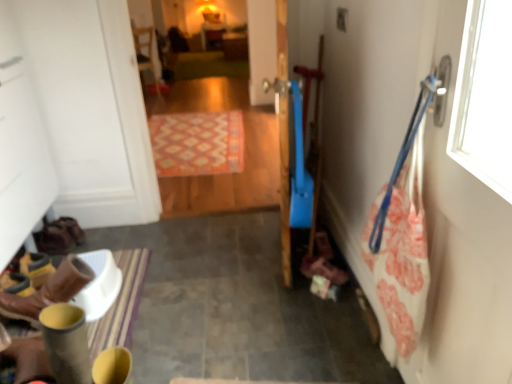
In order to face patterned carpet at center, should I rotate leftwards or rightwards?

A 5.866 degree turn to the left will do.

Where is `patterned carpet at center`? This screenshot has height=384, width=512. patterned carpet at center is located at coordinates (197, 143).

Which is less distant, (274,203) or (32,309)?

Positioned in front is point (32,309).

From the picture: Does patterned carpet at center have a larger size compared to brown leather boots at lower left?

Yes, patterned carpet at center is bigger than brown leather boots at lower left.

Considering the sizes of objects patterned carpet at center and brown leather boots at lower left in the image provided, who is wider, patterned carpet at center or brown leather boots at lower left?

brown leather boots at lower left is wider.

What's the angular difference between patterned carpet at center and brown leather boots at lower left's facing directions?

The angular difference between patterned carpet at center and brown leather boots at lower left is 95.7 degrees.

How different are the orientations of wooden chair at upper center and patterned carpet at center in degrees?

148 degrees separate the facing orientations of wooden chair at upper center and patterned carpet at center.

Can you confirm if wooden chair at upper center is positioned to the right of patterned carpet at center?

No.

Is wooden chair at upper center aimed at patterned carpet at center?

No, wooden chair at upper center is not facing towards patterned carpet at center.

Considering the relative sizes of wooden chair at upper center and patterned carpet at center in the image provided, is wooden chair at upper center taller than patterned carpet at center?

Indeed, wooden chair at upper center has a greater height compared to patterned carpet at center.

In terms of size, does patterned carpet at center appear bigger or smaller than brown leather boots at lower left?

Clearly, patterned carpet at center is larger in size than brown leather boots at lower left.

Is brown leather boots at lower left located within patterned carpet at center?

No, brown leather boots at lower left is located outside of patterned carpet at center.

Can you tell me how much patterned carpet at center and brown leather boots at lower left differ in facing direction?

They differ by 94.4 degrees in their facing directions.

Considering the sizes of objects patterned carpet at center and brown leather boots at lower left in the image provided, who is taller, patterned carpet at center or brown leather boots at lower left?

brown leather boots at lower left is taller.

Consider the image. Is wooden chair at upper center located outside patterned carpet at center?

Absolutely, wooden chair at upper center is external to patterned carpet at center.

Considering the relative sizes of wooden chair at upper center and patterned carpet at center in the image provided, is wooden chair at upper center wider than patterned carpet at center?

Correct, the width of wooden chair at upper center exceeds that of patterned carpet at center.

Is wooden chair at upper center looking in the opposite direction of patterned carpet at center?

Yes, wooden chair at upper center is positioned with its back facing patterned carpet at center.

This screenshot has height=384, width=512. In order to click on chair that appears below the patterned carpet at center (from a real-world perspective) in this screenshot , I will do `click(146, 53)`.

Between wooden chair at upper center and brown leather boots at lower left, which one appears on the right side from the viewer's perspective?

brown leather boots at lower left.

The image size is (512, 384). I want to click on footwear in front of the wooden chair at upper center, so click(49, 291).

Is wooden chair at upper center aimed at brown leather boots at lower left?

No, wooden chair at upper center does not turn towards brown leather boots at lower left.

In the scene shown: Is wooden chair at upper center outside of brown leather boots at lower left?

Yes, wooden chair at upper center is outside of brown leather boots at lower left.

Is patterned carpet at center facing away from patterned carpet at center?

That's right, patterned carpet at center is facing away from patterned carpet at center.

Is patterned carpet at center not close to patterned carpet at center?

Actually, patterned carpet at center and patterned carpet at center are a little close together.

Considering the relative positions of patterned carpet at center and patterned carpet at center in the image provided, is patterned carpet at center to the left of patterned carpet at center from the viewer's perspective?

Incorrect, patterned carpet at center is not on the left side of patterned carpet at center.

From a real-world perspective, relative to patterned carpet at center, is patterned carpet at center vertically above or below?

Clearly, from a real-world perspective, patterned carpet at center is above patterned carpet at center.

Choose the correct answer: Is patterned carpet at center inside wooden chair at upper center or outside it?

The correct answer is: outside.

Can you confirm if patterned carpet at center is positioned to the left of wooden chair at upper center?

No.

Considering the points (253, 136) and (148, 67), which point is in front, point (253, 136) or point (148, 67)?

The point (253, 136) is closer to the camera.

Considering the sizes of objects patterned carpet at center and wooden chair at upper center in the image provided, who is shorter, patterned carpet at center or wooden chair at upper center?

wooden chair at upper center is shorter.

Find the location of a particular element. The width and height of the screenshot is (512, 384). corridor positioned vertically above the brown leather boots at lower left (from a real-world perspective) is located at coordinates (244, 126).

The width and height of the screenshot is (512, 384). Identify the location of mat in front of the wooden chair at upper center. (197, 143).

Based on the photo, looking at the image, which one is located further to patterned carpet at center, patterned carpet at center or wooden chair at upper center?

Among the two, wooden chair at upper center is located further to patterned carpet at center.

Looking at the image, which one is located closer to patterned carpet at center, wooden chair at upper center or brown leather boots at lower left?

wooden chair at upper center.

From the image, which object appears to be farther from patterned carpet at center, patterned carpet at center or brown leather boots at lower left?

brown leather boots at lower left is further to patterned carpet at center.

When comparing their distances from brown leather boots at lower left, does patterned carpet at center or wooden chair at upper center seem further?

wooden chair at upper center.

Based on their spatial positions, is brown leather boots at lower left or wooden chair at upper center closer to patterned carpet at center?

Among the two, wooden chair at upper center is located nearer to patterned carpet at center.

Based on their spatial positions, is brown leather boots at lower left or patterned carpet at center further from wooden chair at upper center?

Among the two, brown leather boots at lower left is located further to wooden chair at upper center.

Based on their spatial positions, is patterned carpet at center or brown leather boots at lower left further from wooden chair at upper center?

Among the two, brown leather boots at lower left is located further to wooden chair at upper center.

Considering their positions, is wooden chair at upper center positioned further to patterned carpet at center than patterned carpet at center?

wooden chair at upper center is positioned further to the anchor patterned carpet at center.

At what (x,y) coordinates should I click in order to perform the action: click on mat between brown leather boots at lower left and wooden chair at upper center from front to back. Please return your answer as a coordinate pair (x, y). Looking at the image, I should click on (197, 143).

Locate an element on the screen. Image resolution: width=512 pixels, height=384 pixels. corridor between brown leather boots at lower left and patterned carpet at center from front to back is located at coordinates (244, 126).

Locate an element on the screen. Image resolution: width=512 pixels, height=384 pixels. corridor between brown leather boots at lower left and wooden chair at upper center in the front-back direction is located at coordinates (244, 126).

At what (x,y) coordinates should I click in order to perform the action: click on mat between patterned carpet at center and wooden chair at upper center along the z-axis. Please return your answer as a coordinate pair (x, y). Looking at the image, I should click on (197, 143).